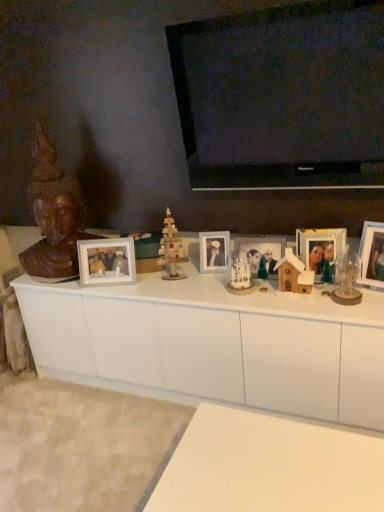
Locate an element on the screen. This screenshot has width=384, height=512. vacant space that is to the left of white ceramic snowman at center, which is the 2th toy in left-to-right order is located at coordinates (202, 291).